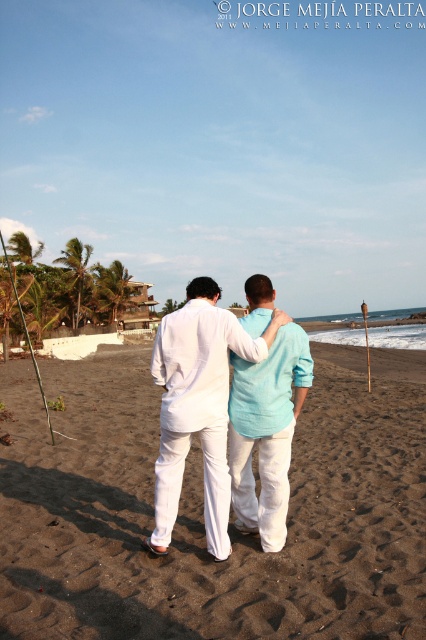
Question: Which object is positioned closest to the light blue linen shirt at center?

Choices:
 (A) white linen shirt at center
 (B) sandy beach at center

Answer: (A)

Question: Among these objects, which one is nearest to the camera?

Choices:
 (A) light blue linen shirt at center
 (B) sandy beach at center

Answer: (B)

Question: Where is sandy beach at center located in relation to white linen shirt at center in the image?

Choices:
 (A) right
 (B) left

Answer: (B)

Question: Considering the relative positions of sandy beach at center and white linen shirt at center in the image provided, where is sandy beach at center located with respect to white linen shirt at center?

Choices:
 (A) right
 (B) left

Answer: (B)

Question: Is the position of white linen shirt at center more distant than that of light blue linen shirt at center?

Choices:
 (A) yes
 (B) no

Answer: (B)

Question: Which point appears farthest from the camera in this image?

Choices:
 (A) (287, 326)
 (B) (216, 444)

Answer: (A)